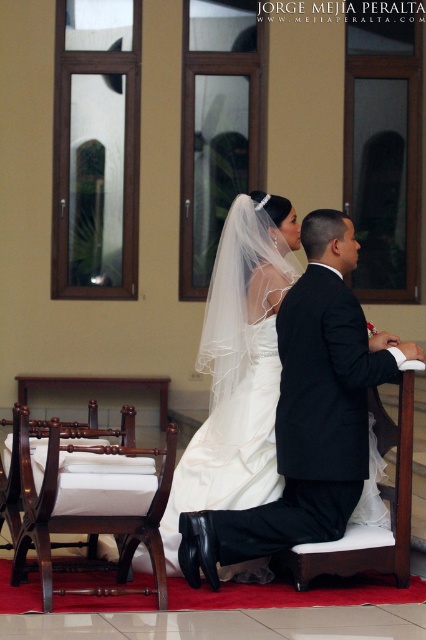
Looking at this image, you are a photographer positioned behind the bride and groom. You want to capture a photo that includes both the white satin dress at center and the mahogany wood chair at left. Which object will appear closer to the camera in the photo?

The white satin dress at center will appear closer to the camera in the photo because it is further to the viewer than the mahogany wood chair at left.

In the wedding scene, you see the bride wearing a white satin dress at center and a white fabric cushion at lower center. Which object is positioned to the left of the other?

The white satin dress at center is to the left of the white fabric cushion at lower center.